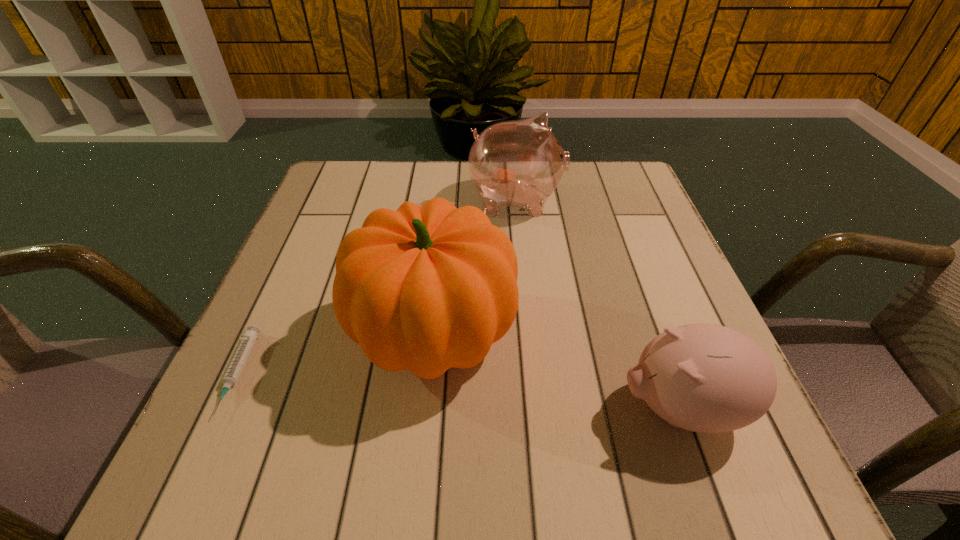
At what (x,y) coordinates should I click in order to perform the action: click on vacant space at the right edge of the desktop. Please return your answer as a coordinate pair (x, y). Looking at the image, I should click on (634, 311).

You are a GUI agent. You are given a task and a screenshot of the screen. Output one action in this format:
    pyautogui.click(x=<x>, y=<y>)
    Task: Click on the free region at the far left corner
    The height and width of the screenshot is (540, 960).
    Given the screenshot: What is the action you would take?
    pyautogui.click(x=348, y=162)

In the image, there is a desktop. Where is `vacant region at the far right corner`? The height and width of the screenshot is (540, 960). vacant region at the far right corner is located at coordinates (614, 181).

The image size is (960, 540). I want to click on free point between the tallest object and the leftmost object, so click(336, 354).

Locate an element on the screen. This screenshot has height=540, width=960. vacant point located between the pumpkin and the leftmost object is located at coordinates (336, 354).

At what (x,y) coordinates should I click in order to perform the action: click on vacant point located between the tallest object and the shorter piggy bank. Please return your answer as a coordinate pair (x, y). This screenshot has width=960, height=540. Looking at the image, I should click on (557, 371).

Identify the location of free spot between the farthest object and the rightmost object. (598, 304).

At what (x,y) coordinates should I click in order to perform the action: click on free space between the tallest object and the second shortest object. Please return your answer as a coordinate pair (x, y). Image resolution: width=960 pixels, height=540 pixels. Looking at the image, I should click on (557, 371).

This screenshot has width=960, height=540. What are the coordinates of `vacant space in between the rightmost object and the tallest object` in the screenshot? It's located at (557, 371).

You are a GUI agent. You are given a task and a screenshot of the screen. Output one action in this format:
    pyautogui.click(x=<x>, y=<y>)
    Task: Click on the empty location between the nearer piggy bank and the syringe
    The width and height of the screenshot is (960, 540).
    Given the screenshot: What is the action you would take?
    pyautogui.click(x=459, y=390)